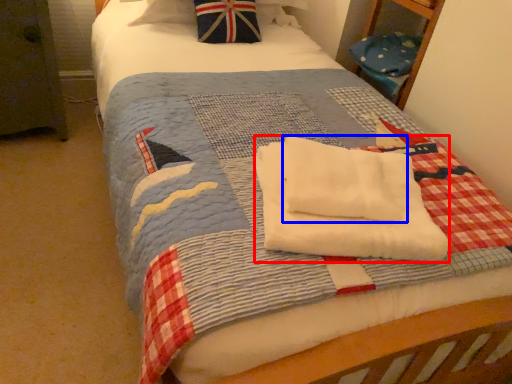
Question: Which point is closer to the camera, beach towel (highlighted by a red box) or beach towel (highlighted by a blue box)?

Choices:
 (A) beach towel
 (B) beach towel

Answer: (A)